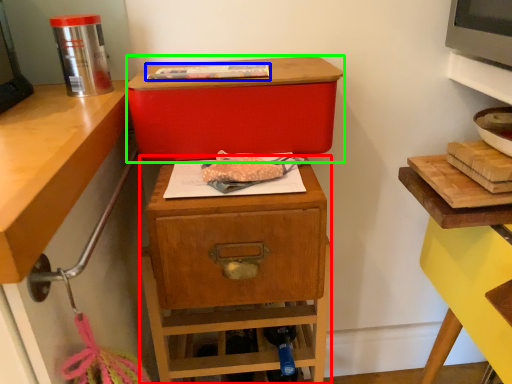
Question: Which object is positioned closest to nightstand (highlighted by a red box)? Select from food (highlighted by a blue box) and storage box (highlighted by a green box).

Choices:
 (A) food
 (B) storage box

Answer: (B)